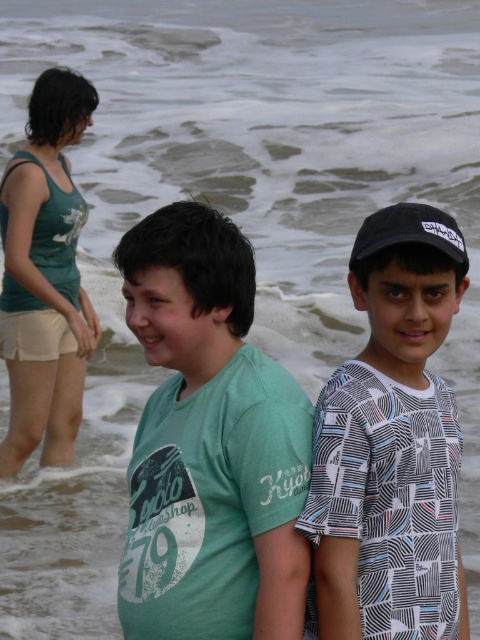
Question: Which of the following is the farthest from the observer?

Choices:
 (A) green matte t-shirt at center
 (B) printed cotton shirt at center
 (C) black matte baseball cap at upper right

Answer: (B)

Question: Considering the real-world distances, which object is closest to the green matte t-shirt at center?

Choices:
 (A) printed cotton shirt at center
 (B) black matte baseball cap at upper right

Answer: (A)

Question: Is printed cotton shirt at center in front of black matte baseball cap at upper right?

Choices:
 (A) no
 (B) yes

Answer: (A)

Question: Among these objects, which one is nearest to the camera?

Choices:
 (A) green matte t-shirt at center
 (B) black matte baseball cap at upper right
 (C) printed cotton shirt at center

Answer: (B)

Question: Is printed cotton shirt at center in front of black matte baseball cap at upper right?

Choices:
 (A) yes
 (B) no

Answer: (B)

Question: Considering the relative positions of green matte t-shirt at center and printed cotton shirt at center in the image provided, where is green matte t-shirt at center located with respect to printed cotton shirt at center?

Choices:
 (A) right
 (B) left

Answer: (B)